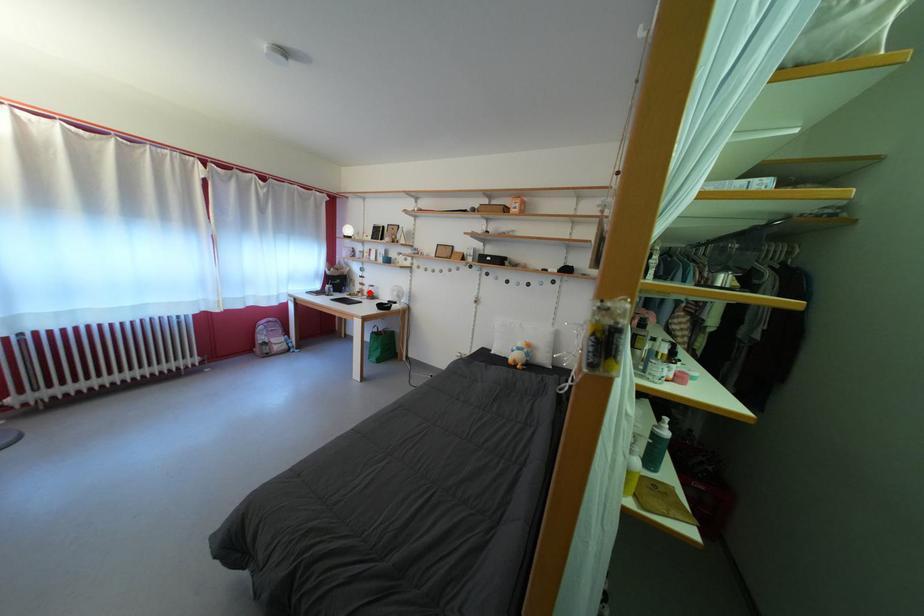
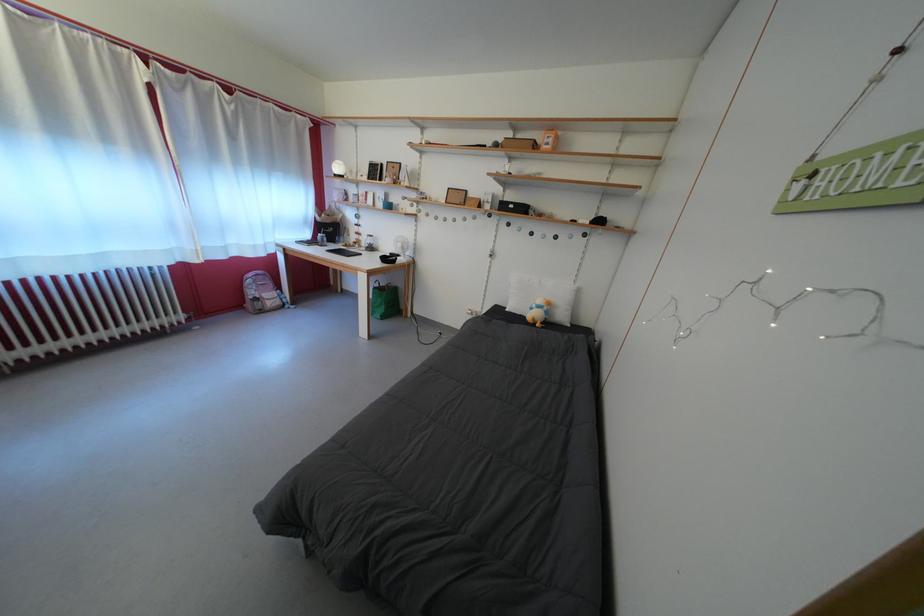
Where in the second image is the point corresponding to the highlighted location from the first image?

(365, 243)